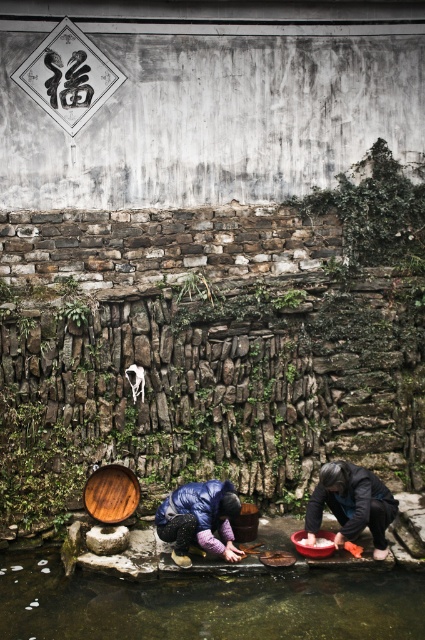
You are standing in front of the stone wall and see the clear water at lower center and the purple down jacket at lower center. Which one takes up more space in the image?

The clear water at lower center is bigger than the purple down jacket at lower center, so it takes up more space in the image.

You are organizing a clothing donation drive and need to stack the dark gray fabric at lower right and the purple down jacket at lower center. Which item should you place first if you want to maximize the stability of the stack?

You should place the dark gray fabric at lower right first because it is wider than the purple down jacket at lower center, providing a larger base for stability.